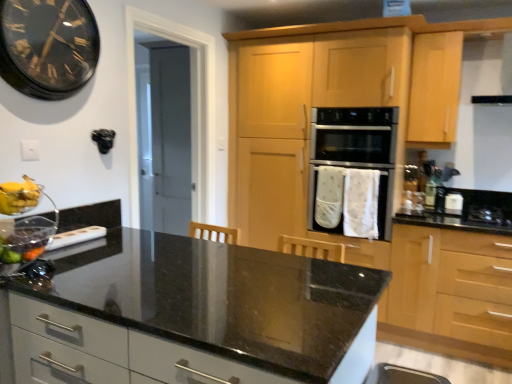
Question: Can you confirm if black glass gas stove at right is shorter than white fabric oven at center?

Choices:
 (A) no
 (B) yes

Answer: (B)

Question: Considering the relative positions of black glass gas stove at right and white fabric oven at center in the image provided, is black glass gas stove at right in front of white fabric oven at center?

Choices:
 (A) yes
 (B) no

Answer: (A)

Question: From a real-world perspective, is black glass gas stove at right over white fabric oven at center?

Choices:
 (A) yes
 (B) no

Answer: (B)

Question: Does black glass gas stove at right come behind white fabric oven at center?

Choices:
 (A) yes
 (B) no

Answer: (B)

Question: Can you see black glass gas stove at right touching white fabric oven at center?

Choices:
 (A) no
 (B) yes

Answer: (A)

Question: Could you tell me if black glass gas stove at right is facing white fabric oven at center?

Choices:
 (A) yes
 (B) no

Answer: (B)

Question: From a real-world perspective, is black matte exhaust hood at upper right physically above black glass clock at upper left?

Choices:
 (A) no
 (B) yes

Answer: (B)

Question: Is black matte exhaust hood at upper right positioned with its back to black glass clock at upper left?

Choices:
 (A) no
 (B) yes

Answer: (A)

Question: From the image's perspective, is black matte exhaust hood at upper right located beneath black glass clock at upper left?

Choices:
 (A) yes
 (B) no

Answer: (B)

Question: Is black glass clock at upper left surrounded by black matte exhaust hood at upper right?

Choices:
 (A) no
 (B) yes

Answer: (A)

Question: Is black matte exhaust hood at upper right further to the viewer compared to black glass clock at upper left?

Choices:
 (A) yes
 (B) no

Answer: (A)

Question: Is black matte exhaust hood at upper right bigger than black glass clock at upper left?

Choices:
 (A) no
 (B) yes

Answer: (B)

Question: Does light wood/texture cabinet at right, the 2th cabinetry in the left-to-right sequence, have a larger size compared to black glass clock at upper left?

Choices:
 (A) yes
 (B) no

Answer: (A)